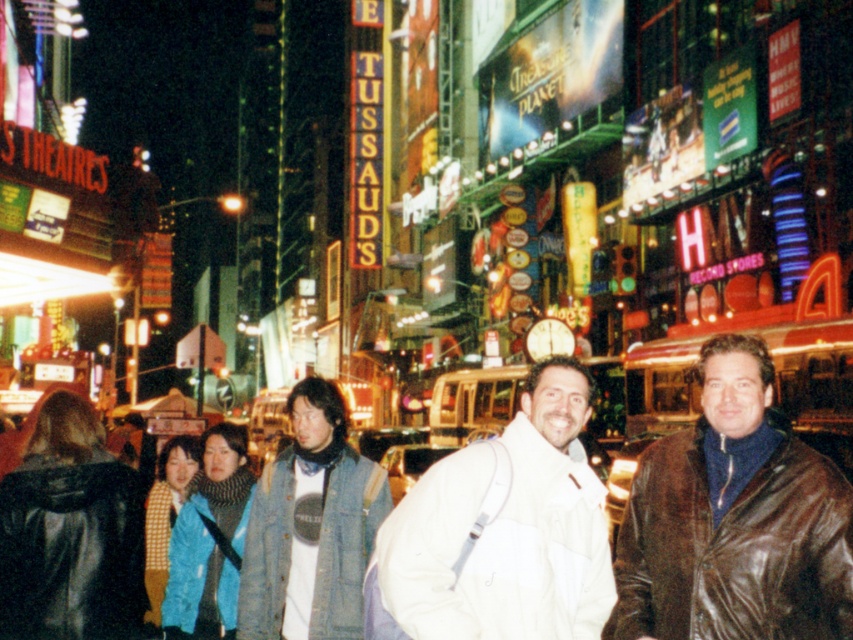
You are a photographer standing in Times Square, and you want to capture both the brown leather jacket at center and the white matte jacket at center in the same frame. Your camera has a maximum focus range of 5 meters. Can you include both jackets in your photo without moving your position?

The brown leather jacket at center is 4.89 meters away from the white matte jacket at center. Since the distance between them is within the camera maximum focus range of 5 meters, you can include both jackets in your photo without moving your position.

You are a photographer standing in Times Square, and you want to take a picture of both the white matte jacket at center and the denim jacket at center. Which jacket will appear larger in the photo?

The white matte jacket at center will appear larger in the photo because it is closer to the viewer than the denim jacket at center.

You are a photographer trying to capture the brown leather jacket at center in your shot. The camera is positioned at the origin point. Which direction should you move the camera to focus on the jacket?

The brown leather jacket at center is located at point 0.814 on the x axis and 0.862 on the y axis. Since the camera is at the origin, you should move the camera to the right and upwards to focus on the jacket.